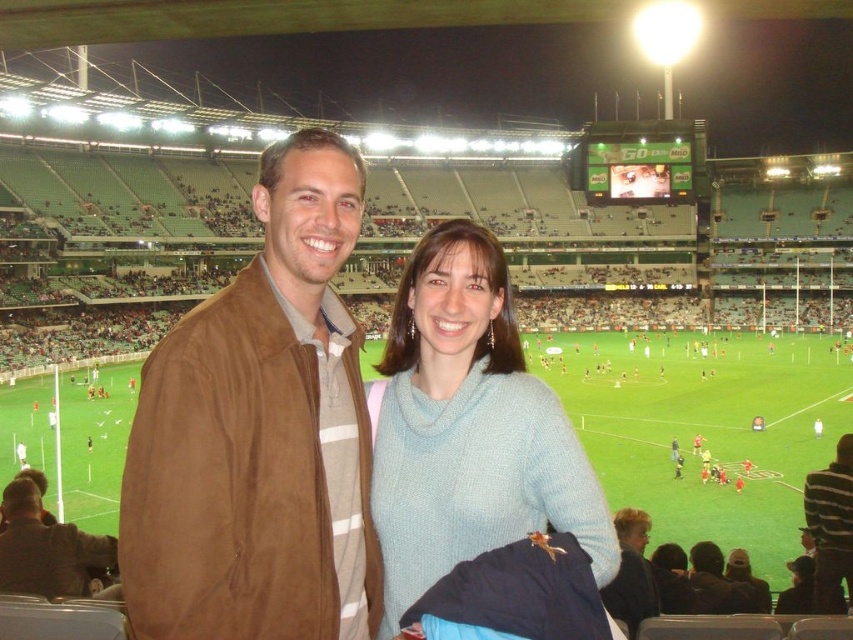
Question: Does light blue sweater at center have a lesser width compared to brown leather jacket at lower left?

Choices:
 (A) yes
 (B) no

Answer: (B)

Question: Among these points, which one is nearest to the camera?

Choices:
 (A) (842, 556)
 (B) (170, 584)
 (C) (438, 554)
 (D) (39, 570)

Answer: (B)

Question: Is brown suede jacket at center above light blue sweater at center?

Choices:
 (A) no
 (B) yes

Answer: (B)

Question: Which point appears closest to the camera in this image?

Choices:
 (A) (3, 580)
 (B) (497, 477)
 (C) (223, 385)

Answer: (C)

Question: Is light blue sweater at center above striped sweater at center?

Choices:
 (A) yes
 (B) no

Answer: (A)

Question: Based on their relative distances, which object is farther from the striped sweater at center?

Choices:
 (A) brown suede jacket at center
 (B) light blue sweater at center

Answer: (A)